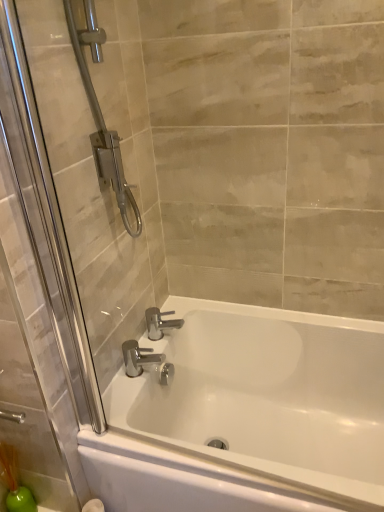
What is the approximate height of chrome metallic faucet at center, placed as the first tap when sorted from back to front?

It is 4.34 inches.

Measure the distance between white glossy bathtub at center and camera.

34.48 inches.

Measure the distance between polished chrome faucet at lower center, which appears as the 1th tap when viewed from the front, and camera.

polished chrome faucet at lower center, which appears as the 1th tap when viewed from the front, is 1.27 meters away from camera.

Image resolution: width=384 pixels, height=512 pixels. I want to click on chrome metallic faucet at center, arranged as the second tap when viewed from the front, so click(x=159, y=322).

Who is taller, polished chrome faucet at lower center, which appears as the 1th tap when viewed from the front, or white glossy bathtub at center?

Standing taller between the two is white glossy bathtub at center.

In the image, there is a polished chrome faucet at lower center, which appears as the 1th tap when viewed from the front. At what (x,y) coordinates should I click in order to perform the action: click on bathtub below it (from the image's perspective). Please return your answer as a coordinate pair (x, y). The image size is (384, 512). Looking at the image, I should click on (246, 415).

Based on their positions, is polished chrome faucet at lower center, the second tap from the back, located to the left or right of white glossy bathtub at center?

From the image, it's evident that polished chrome faucet at lower center, the second tap from the back, is to the left of white glossy bathtub at center.

Looking at this image, which object is closer to the camera taking this photo, polished chrome faucet at lower center, which appears as the 1th tap when viewed from the front, or white glossy bathtub at center?

white glossy bathtub at center is more forward.

Measure the distance from polished chrome faucet at lower center, which appears as the 1th tap when viewed from the front, to chrome metallic faucet at center, arranged as the second tap when viewed from the front.

A distance of 4.65 inches exists between polished chrome faucet at lower center, which appears as the 1th tap when viewed from the front, and chrome metallic faucet at center, arranged as the second tap when viewed from the front.

Can you confirm if polished chrome faucet at lower center, the second tap from the back, is smaller than chrome metallic faucet at center, arranged as the second tap when viewed from the front?

Indeed, polished chrome faucet at lower center, the second tap from the back, has a smaller size compared to chrome metallic faucet at center, arranged as the second tap when viewed from the front.

From a real-world perspective, is polished chrome faucet at lower center, the second tap from the back, beneath chrome metallic faucet at center, arranged as the second tap when viewed from the front?

Yes.

From the image's perspective, which is above, chrome metallic faucet at center, arranged as the second tap when viewed from the front, or white glossy bathtub at center?

From the image's view, chrome metallic faucet at center, arranged as the second tap when viewed from the front, is above.

Does chrome metallic faucet at center, arranged as the second tap when viewed from the front, have a larger size compared to white glossy bathtub at center?

No, chrome metallic faucet at center, arranged as the second tap when viewed from the front, is not bigger than white glossy bathtub at center.

Is point (156, 329) behind point (299, 385)?

No, it is not.

Is chrome metallic faucet at center, placed as the first tap when sorted from back to front, aimed at white glossy bathtub at center?

No, chrome metallic faucet at center, placed as the first tap when sorted from back to front, is not oriented towards white glossy bathtub at center.

Based on the photo, from the image's perspective, between chrome metallic faucet at center, placed as the first tap when sorted from back to front, and polished chrome faucet at lower center, the second tap from the back, who is located below?

polished chrome faucet at lower center, the second tap from the back.

The width and height of the screenshot is (384, 512). In the image, there is a chrome metallic faucet at center, placed as the first tap when sorted from back to front. Identify the location of tap below it (from the image's perspective). (139, 358).

Based on the photo, could you measure the distance between chrome metallic faucet at center, arranged as the second tap when viewed from the front, and polished chrome faucet at lower center, the second tap from the back?

A distance of 4.65 inches exists between chrome metallic faucet at center, arranged as the second tap when viewed from the front, and polished chrome faucet at lower center, the second tap from the back.

Is chrome metallic faucet at center, arranged as the second tap when viewed from the front, situated inside polished chrome faucet at lower center, the second tap from the back, or outside?

chrome metallic faucet at center, arranged as the second tap when viewed from the front, is spatially situated outside polished chrome faucet at lower center, the second tap from the back.

Is white glossy bathtub at center looking in the opposite direction of chrome metallic faucet at center, placed as the first tap when sorted from back to front?

No, white glossy bathtub at center's orientation is not away from chrome metallic faucet at center, placed as the first tap when sorted from back to front.

Consider the image. From a real-world perspective, between white glossy bathtub at center and chrome metallic faucet at center, placed as the first tap when sorted from back to front, who is vertically higher?

In real-world perspective, chrome metallic faucet at center, placed as the first tap when sorted from back to front, is above.

Could you measure the distance between white glossy bathtub at center and chrome metallic faucet at center, placed as the first tap when sorted from back to front?

white glossy bathtub at center is 40.57 centimeters away from chrome metallic faucet at center, placed as the first tap when sorted from back to front.

Considering the sizes of white glossy bathtub at center and chrome metallic faucet at center, arranged as the second tap when viewed from the front, in the image, is white glossy bathtub at center wider or thinner than chrome metallic faucet at center, arranged as the second tap when viewed from the front,?

white glossy bathtub at center is wider than chrome metallic faucet at center, arranged as the second tap when viewed from the front.

Looking at this image, from the image's perspective, is white glossy bathtub at center on polished chrome faucet at lower center, which appears as the 1th tap when viewed from the front?

No, from the image's perspective, white glossy bathtub at center is not over polished chrome faucet at lower center, which appears as the 1th tap when viewed from the front.

Based on the photo, is white glossy bathtub at center completely or partially outside of polished chrome faucet at lower center, the second tap from the back?

white glossy bathtub at center lies outside polished chrome faucet at lower center, the second tap from the back,'s area.

Between point (208, 377) and point (131, 342), which one is positioned in front?

Point (131, 342)

Can you confirm if white glossy bathtub at center is wider than polished chrome faucet at lower center, the second tap from the back?

Indeed, white glossy bathtub at center has a greater width compared to polished chrome faucet at lower center, the second tap from the back.

The height and width of the screenshot is (512, 384). In order to click on the 1st tap above the white glossy bathtub at center (from a real-world perspective) in this screenshot , I will do point(139,358).

Identify the location of tap behind the polished chrome faucet at lower center, the second tap from the back. Image resolution: width=384 pixels, height=512 pixels. (159, 322).

Which object lies nearer to the anchor point white glossy bathtub at center, polished chrome faucet at lower center, which appears as the 1th tap when viewed from the front, or chrome metallic faucet at center, arranged as the second tap when viewed from the front?

Among the two, polished chrome faucet at lower center, which appears as the 1th tap when viewed from the front, is located nearer to white glossy bathtub at center.

Estimate the real-world distances between objects in this image. Which object is closer to chrome metallic faucet at center, arranged as the second tap when viewed from the front, polished chrome faucet at lower center, the second tap from the back, or white glossy bathtub at center?

Among the two, polished chrome faucet at lower center, the second tap from the back, is located nearer to chrome metallic faucet at center, arranged as the second tap when viewed from the front.

Consider the image. Which object lies nearer to the anchor point polished chrome faucet at lower center, the second tap from the back, chrome metallic faucet at center, placed as the first tap when sorted from back to front, or white glossy bathtub at center?

chrome metallic faucet at center, placed as the first tap when sorted from back to front, is closer to polished chrome faucet at lower center, the second tap from the back.

Which object lies further to the anchor point polished chrome faucet at lower center, which appears as the 1th tap when viewed from the front, white glossy bathtub at center or chrome metallic faucet at center, arranged as the second tap when viewed from the front?

The object further to polished chrome faucet at lower center, which appears as the 1th tap when viewed from the front, is white glossy bathtub at center.

From the image, which object appears to be nearer to chrome metallic faucet at center, arranged as the second tap when viewed from the front, white glossy bathtub at center or polished chrome faucet at lower center, the second tap from the back?

polished chrome faucet at lower center, the second tap from the back, is positioned closer to the anchor chrome metallic faucet at center, arranged as the second tap when viewed from the front.

Looking at the image, which one is located further to white glossy bathtub at center, chrome metallic faucet at center, placed as the first tap when sorted from back to front, or polished chrome faucet at lower center, which appears as the 1th tap when viewed from the front?

chrome metallic faucet at center, placed as the first tap when sorted from back to front, is positioned further to the anchor white glossy bathtub at center.

You are a GUI agent. You are given a task and a screenshot of the screen. Output one action in this format:
    pyautogui.click(x=<x>, y=<y>)
    Task: Click on the tap located between white glossy bathtub at center and chrome metallic faucet at center, arranged as the second tap when viewed from the front, in the depth direction
    
    Given the screenshot: What is the action you would take?
    pyautogui.click(x=139, y=358)